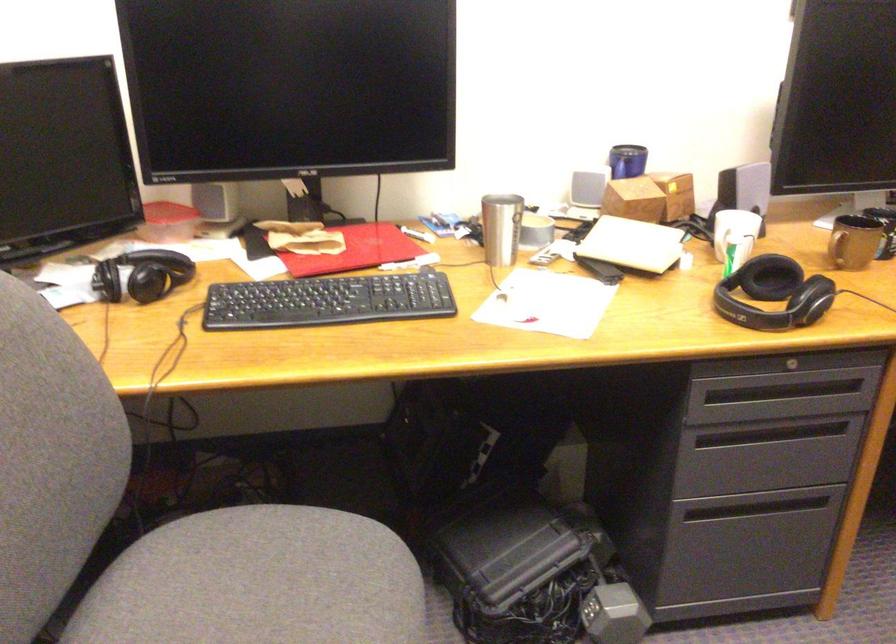
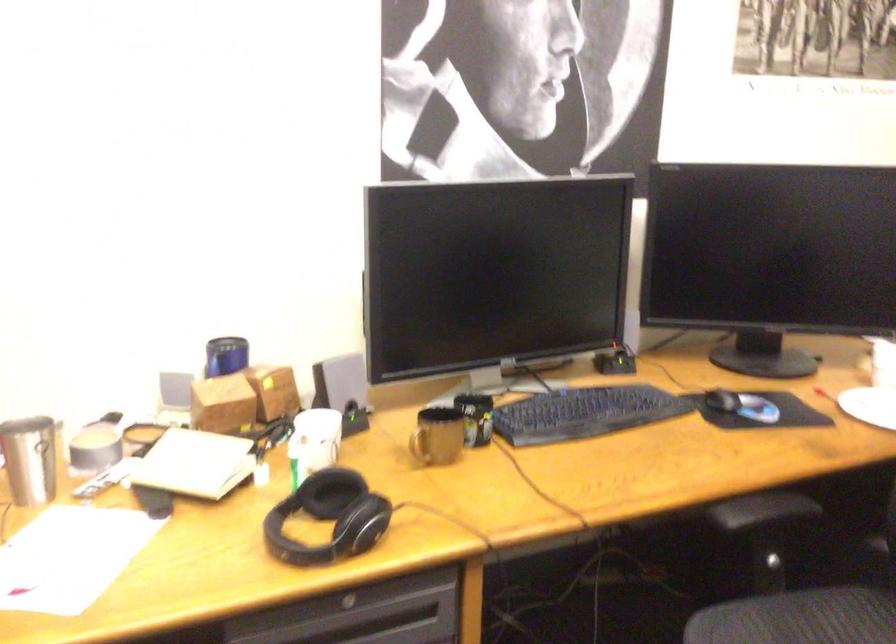
Question: The images are taken continuously from a first-person perspective. In which direction is your viewpoint rotating?

Choices:
 (A) Left
 (B) Right
 (C) Up
 (D) Down

Answer: (B)